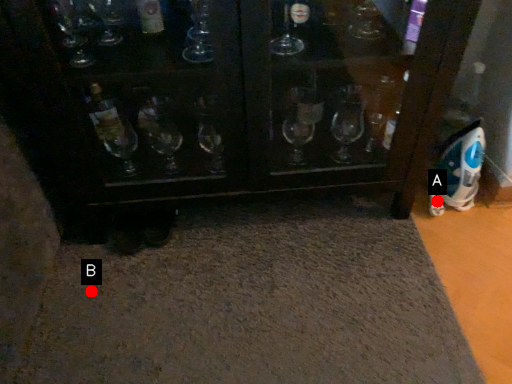
Question: Two points are circled on the image, labeled by A and B beside each circle. Among these points, which one is farthest from the camera?

Choices:
 (A) A is further
 (B) B is further

Answer: (A)